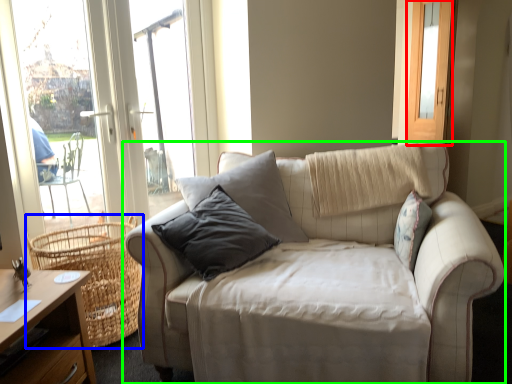
Question: Which is farther away from screen door (highlighted by a red box)? basket (highlighted by a blue box) or studio couch (highlighted by a green box)?

Choices:
 (A) basket
 (B) studio couch

Answer: (A)